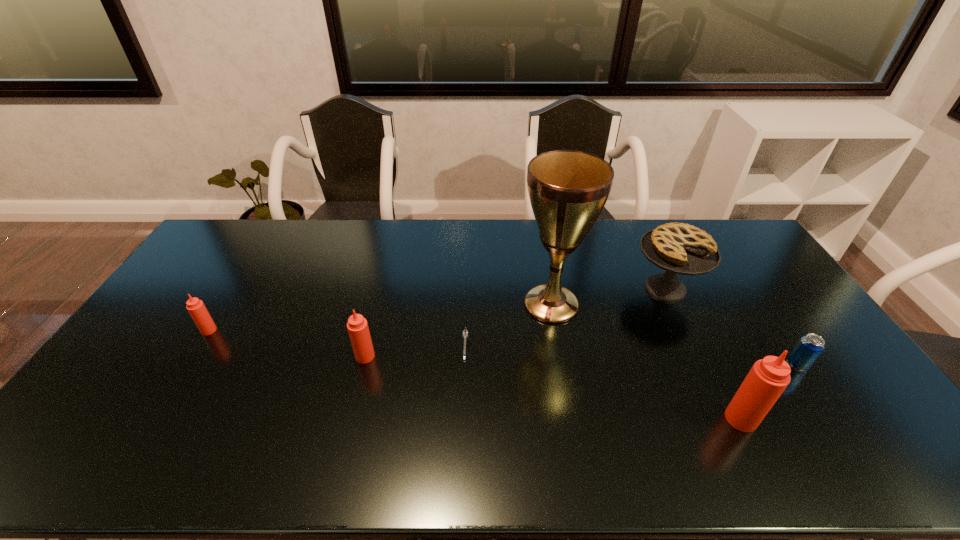
Identify the location of trophy cup. The width and height of the screenshot is (960, 540). (568, 189).

At what (x,y) coordinates should I click in order to perform the action: click on the rightmost object. Please return your answer as a coordinate pair (x, y). Looking at the image, I should click on click(x=810, y=346).

Identify the location of the second shortest object. (810, 346).

At what (x,y) coordinates should I click in order to perform the action: click on blank space located 0.400m on the back of the third shortest object. Please return your answer as a coordinate pair (x, y). This screenshot has width=960, height=540. Looking at the image, I should click on (261, 247).

Locate an element on the screen. Image resolution: width=960 pixels, height=540 pixels. vacant position located on the left of the second tallest Tabasco sauce is located at coordinates (248, 356).

Identify the location of vacant space positioned 0.210m on the back of the tallest Tabasco sauce. (704, 343).

What are the coordinates of `free point located on the cut side of the pie` in the screenshot? It's located at (706, 374).

Locate an element on the screen. The height and width of the screenshot is (540, 960). free region located 0.090m on the front-facing side of the fifth object from right to left is located at coordinates (464, 400).

Locate an element on the screen. free region located on the right of the trophy cup is located at coordinates (622, 304).

This screenshot has width=960, height=540. Find the location of `vacant space located 0.190m on the back of the beer can`. vacant space located 0.190m on the back of the beer can is located at coordinates (760, 309).